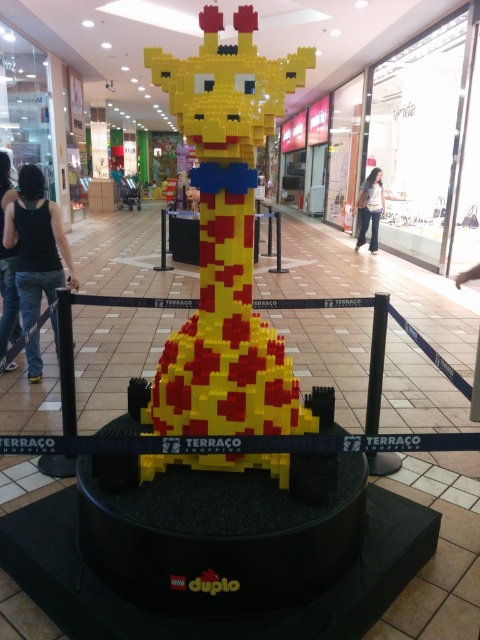
Can you confirm if yellow lego giraffe at center is taller than black rubber barrier at center?

Yes, yellow lego giraffe at center is taller than black rubber barrier at center.

Which is in front, point (214, 112) or point (180, 304)?

Point (214, 112) is more forward.

This screenshot has width=480, height=640. What do you see at coordinates (227, 241) in the screenshot? I see `yellow lego giraffe at center` at bounding box center [227, 241].

At what (x,y) coordinates should I click in order to perform the action: click on yellow lego giraffe at center. Please return your answer as a coordinate pair (x, y). Looking at the image, I should click on (227, 241).

Does black tank top at center appear on the left side of black denim jeans at lower left?

Incorrect, black tank top at center is not on the left side of black denim jeans at lower left.

How far apart are black tank top at center and black denim jeans at lower left?

They are 10.70 inches apart.

What do you see at coordinates (36, 244) in the screenshot? I see `black tank top at center` at bounding box center [36, 244].

Where is `black tank top at center`? The width and height of the screenshot is (480, 640). black tank top at center is located at coordinates (36, 244).

Can you confirm if black rubber barrier at center is taller than black denim jeans at lower left?

No.

Who is taller, black rubber barrier at center or black denim jeans at lower left?

With more height is black denim jeans at lower left.

You are a GUI agent. You are given a task and a screenshot of the screen. Output one action in this format:
    pyautogui.click(x=<x>, y=<y>)
    Task: Click on the black rubber barrier at center
    
    Given the screenshot: What is the action you would take?
    point(219,436)